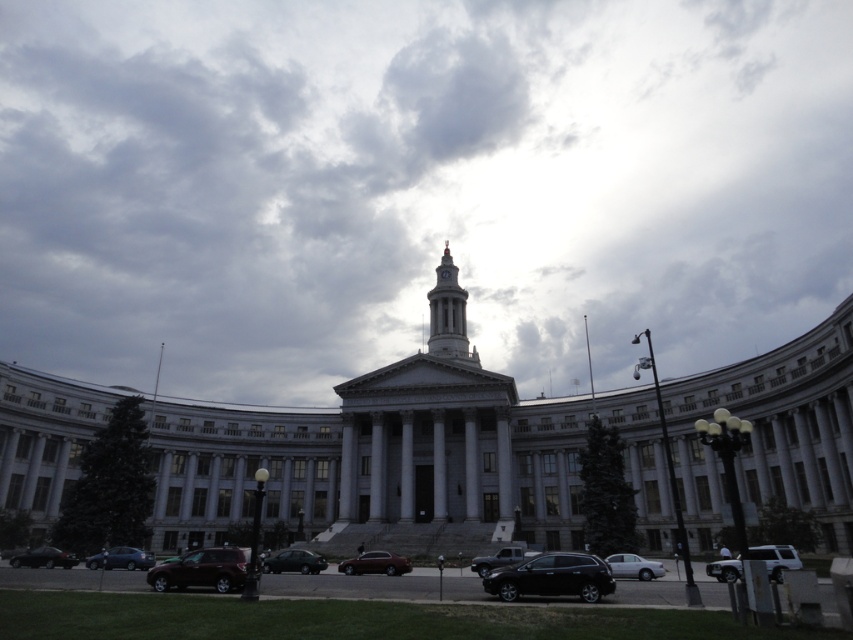
Between white matte suv at center and silver metallic sedan at lower right, which one appears on the left side from the viewer's perspective?

From the viewer's perspective, silver metallic sedan at lower right appears more on the left side.

Can you confirm if white matte suv at center is bigger than silver metallic sedan at lower right?

Yes, white matte suv at center is bigger than silver metallic sedan at lower right.

Does point (735, 564) come farther from viewer compared to point (659, 573)?

No, (735, 564) is closer to viewer.

Locate an element on the screen. white matte suv at center is located at coordinates (776, 557).

Who is positioned more to the left, metallic maroon sedan at center or matte black sedan at center?

matte black sedan at center is more to the left.

Between metallic maroon sedan at center and matte black sedan at center, which one has more height?

With more height is metallic maroon sedan at center.

This screenshot has width=853, height=640. Describe the element at coordinates (375, 563) in the screenshot. I see `metallic maroon sedan at center` at that location.

Identify the location of metallic maroon sedan at center. The width and height of the screenshot is (853, 640). (375, 563).

From the picture: Does shiny maroon sedan at lower left have a larger size compared to matte black suv at center?

Correct, shiny maroon sedan at lower left is larger in size than matte black suv at center.

Can you confirm if shiny maroon sedan at lower left is taller than matte black suv at center?

Indeed, shiny maroon sedan at lower left has a greater height compared to matte black suv at center.

Does point (225, 572) lie in front of point (491, 563)?

That is True.

At what (x,y) coordinates should I click in order to perform the action: click on shiny maroon sedan at lower left. Please return your answer as a coordinate pair (x, y). This screenshot has height=640, width=853. Looking at the image, I should click on (201, 570).